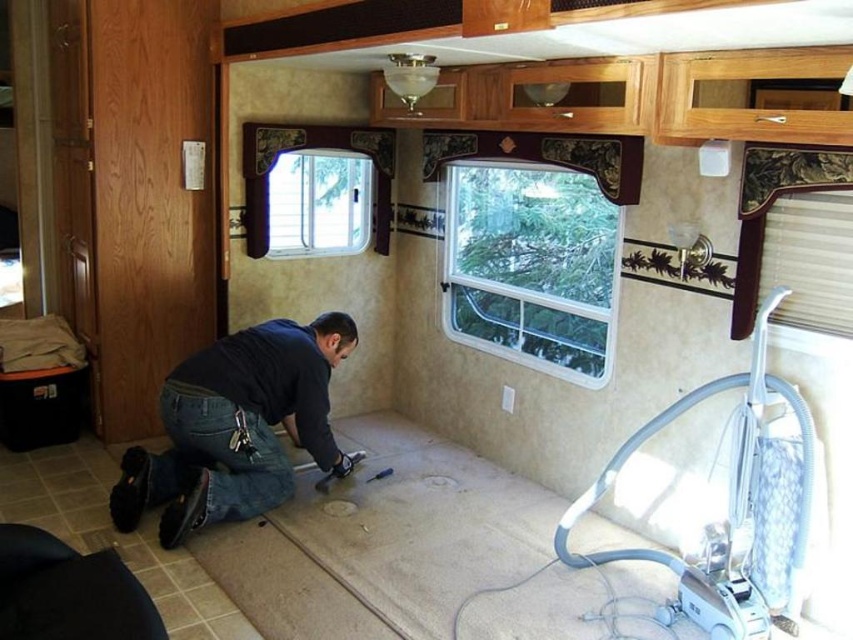
This screenshot has width=853, height=640. In order to click on clear glass window at upper center in this screenshot , I will do `click(531, 266)`.

Is point (560, 205) in front of point (299, 330)?

That is False.

This screenshot has width=853, height=640. Describe the element at coordinates (531, 266) in the screenshot. I see `clear glass window at upper center` at that location.

The width and height of the screenshot is (853, 640). What are the coordinates of `clear glass window at upper center` in the screenshot? It's located at (531, 266).

Can you confirm if clear glass window at upper center is positioned above clear glass window at upper left?

No, clear glass window at upper center is not above clear glass window at upper left.

Who is taller, clear glass window at upper center or clear glass window at upper left?

Standing taller between the two is clear glass window at upper center.

Does point (596, 323) come closer to viewer compared to point (354, 221)?

Yes, it is in front of point (354, 221).

In order to click on clear glass window at upper center in this screenshot , I will do `click(531, 266)`.

Does dark blue jeans at lower left come behind clear glass window at upper left?

No, dark blue jeans at lower left is closer to the viewer.

Does dark blue jeans at lower left have a greater width compared to clear glass window at upper left?

Yes, dark blue jeans at lower left is wider than clear glass window at upper left.

The width and height of the screenshot is (853, 640). What are the coordinates of `dark blue jeans at lower left` in the screenshot? It's located at (236, 426).

The image size is (853, 640). Identify the location of dark blue jeans at lower left. (236, 426).